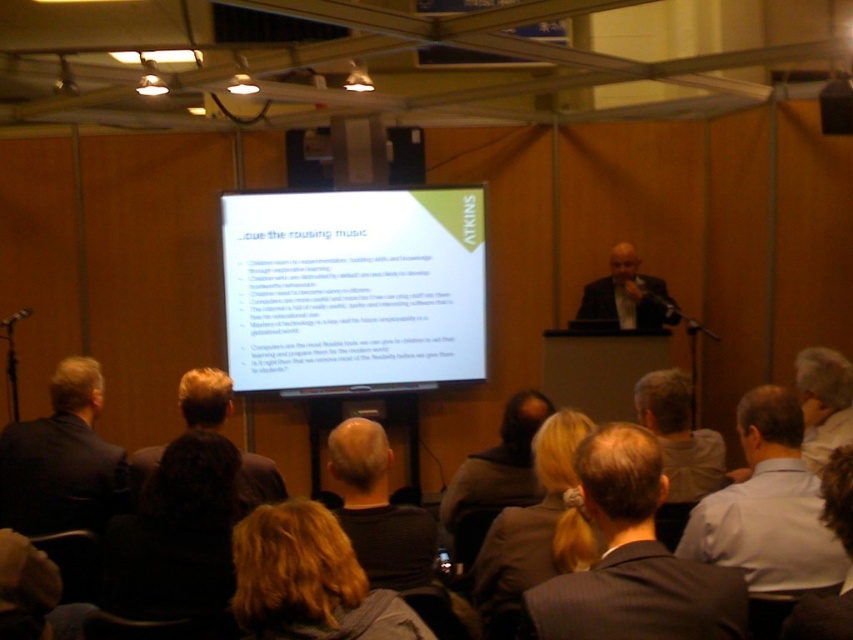
Question: Does dark blue suit at left have a larger size compared to blonde hair at upper center?

Choices:
 (A) yes
 (B) no

Answer: (A)

Question: Which object appears farthest from the camera in this image?

Choices:
 (A) dark brown hair at center
 (B) blonde hair at upper center
 (C) dark blue suit at left

Answer: (C)

Question: Which point is farther from the camera taking this photo?

Choices:
 (A) (372, 458)
 (B) (277, 540)
 (C) (746, 556)
 (D) (459, 474)

Answer: (D)

Question: Does gray shirt at lower right have a smaller size compared to dark brown hair at center?

Choices:
 (A) no
 (B) yes

Answer: (B)

Question: Which object is closer to the camera taking this photo?

Choices:
 (A) dark brown suit at center
 (B) dark brown hair at center
 (C) light brown hair at center
 (D) light brown hair at upper right

Answer: (A)

Question: Is light brown hair at center smaller than dark suit at center?

Choices:
 (A) no
 (B) yes

Answer: (B)